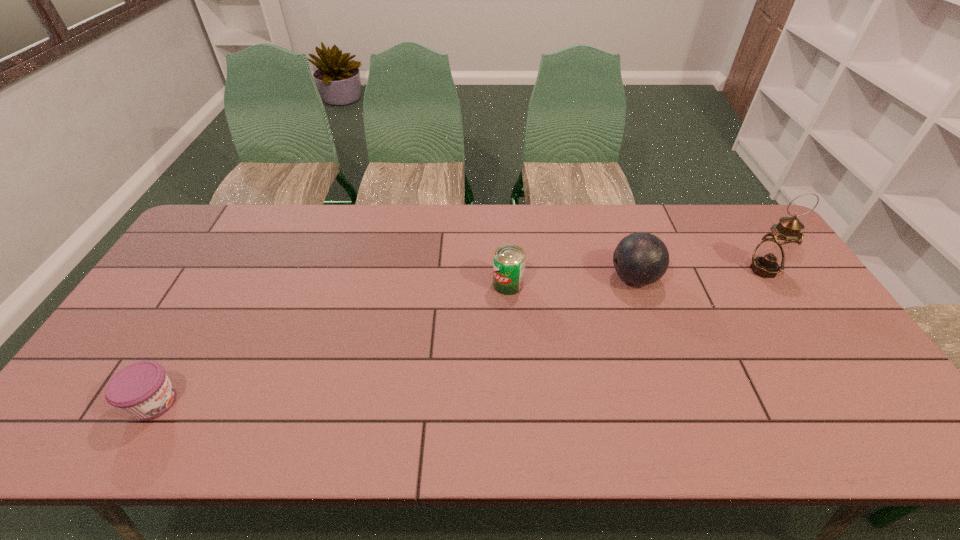
Find the location of a particular element. The image size is (960, 540). vacant point at the left edge is located at coordinates (194, 312).

Where is `vacant space at the right edge of the desktop`? Image resolution: width=960 pixels, height=540 pixels. vacant space at the right edge of the desktop is located at coordinates (774, 319).

Identify the location of vacant space at the far left corner. The image size is (960, 540). (225, 232).

In the image, there is a desktop. Identify the location of vacant space at the far right corner. (740, 233).

Identify the location of free point between the tallest object and the third object from left to right. The width and height of the screenshot is (960, 540). (699, 274).

Identify the location of free space between the oil lamp and the third object from left to right. The height and width of the screenshot is (540, 960). (699, 274).

This screenshot has height=540, width=960. Find the location of `vacant space in between the second object from left to right and the bowling ball`. vacant space in between the second object from left to right and the bowling ball is located at coordinates (571, 281).

Locate an element on the screen. Image resolution: width=960 pixels, height=540 pixels. vacant region between the nearest object and the second shortest object is located at coordinates (331, 343).

In order to click on free area in between the second object from left to right and the shortest object in this screenshot , I will do `click(331, 343)`.

Locate an element on the screen. vacant point located between the second shortest object and the nearest object is located at coordinates (331, 343).